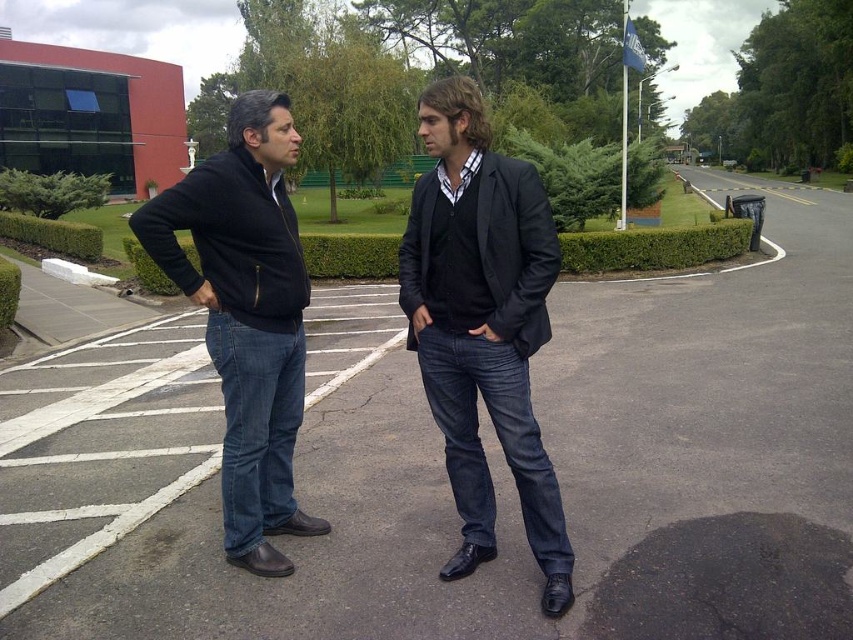
You are a delivery person trying to park your vehicle in the parking lot. You see the dark asphalt parking lot at center and the matte black blazer at center. Which object is closer to the ground?

The matte black blazer at center is closer to the ground because the dark asphalt parking lot at center is above it.

You are a fashion designer observing the two people in the parking lot. You notice the matte black blazer at center and the dark blue jeans at center. Which clothing item is positioned lower on the person?

The matte black blazer at center is located below dark blue jeans at center, meaning the blazer is lower than the jeans on the person.

You are standing in the parking lot and want to walk towards the building. There are two points marked on the ground, point (502, 426) and point (239, 360). Which point should you step on first if you want to reach the building faster?

Point (502, 426) is closer to the camera than point (239, 360), so stepping on point (502, 426) first would be closer to the building and faster.